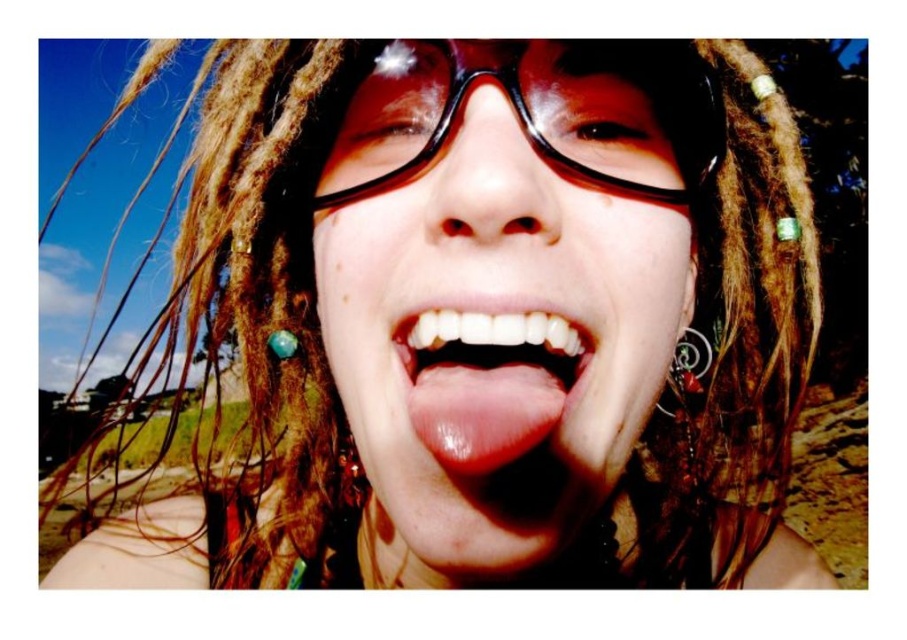
What is the exact coordinate position of the shiny white teeth at center in the image?

The shiny white teeth at center is located at point (486,381).

The scene shows a person wearing two pairs of glasses. The satin black glasses at center and the transparent plastic glasses at center. Which pair is bigger?

The satin black glasses at center is larger in size than the transparent plastic glasses at center.

You are a photographer trying to capture a closeup of the shiny white teeth at center. The camera you are using has a minimum focusing distance of 16 inches. Do you need to move closer or farther away to get the teeth in focus?

The shiny white teeth at center is 15.51 inches from the camera, which is closer than the minimum focusing distance of 16 inches. Therefore, you need to move slightly farther away from the subject to ensure the teeth are in focus.